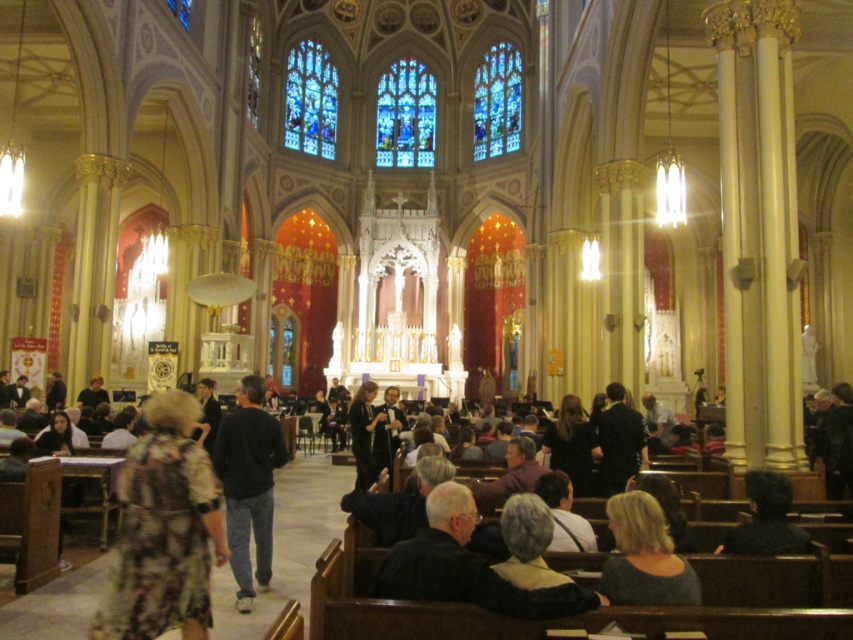
Question: Which is nearer to the black sweater at center?

Choices:
 (A) floral-patterned dress at lower left
 (B) stained glass window at upper center
 (C) stained glass at center

Answer: (A)

Question: Is floral-patterned dress at lower left in front of stained glass at center?

Choices:
 (A) no
 (B) yes

Answer: (B)

Question: Is stained glass window at center bigger than dark brown hair at lower right?

Choices:
 (A) no
 (B) yes

Answer: (B)

Question: Which point is closer to the camera taking this photo?

Choices:
 (A) (410, 160)
 (B) (289, 109)

Answer: (B)

Question: Which object is closer to the camera taking this photo?

Choices:
 (A) dark brown hair at lower right
 (B) stained glass window at center
 (C) stained glass at center
 (D) black sweater at center

Answer: (A)

Question: Is stained glass at center above stained glass window at upper center?

Choices:
 (A) no
 (B) yes

Answer: (B)